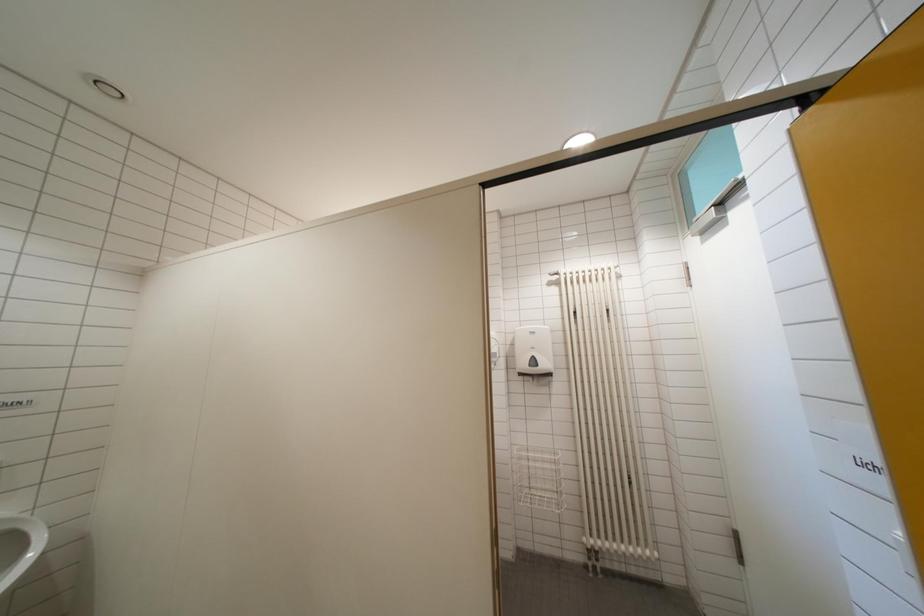
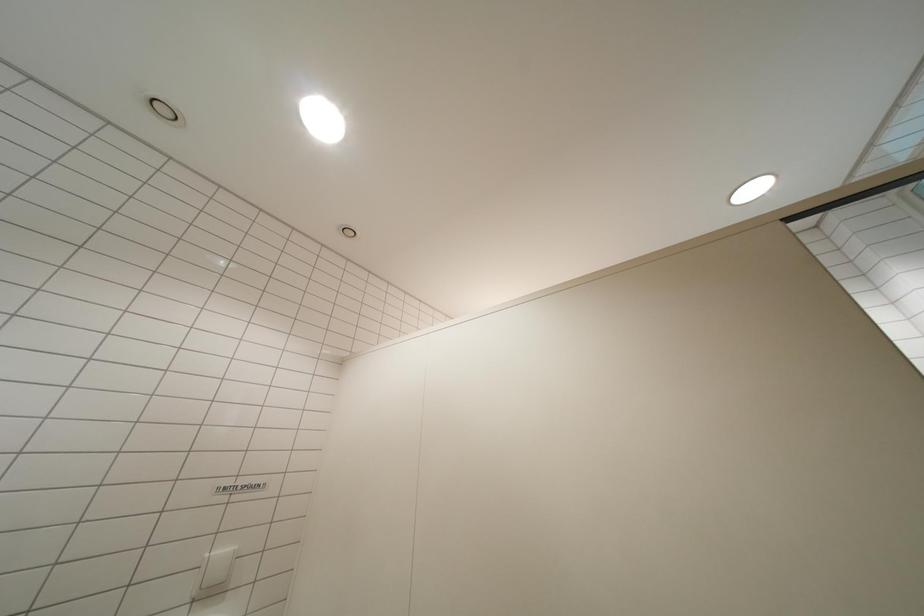
Question: The images are taken continuously from a first-person perspective. In which direction are you moving?

Choices:
 (A) Left
 (B) Right
 (C) Forward
 (D) Backward

Answer: (A)